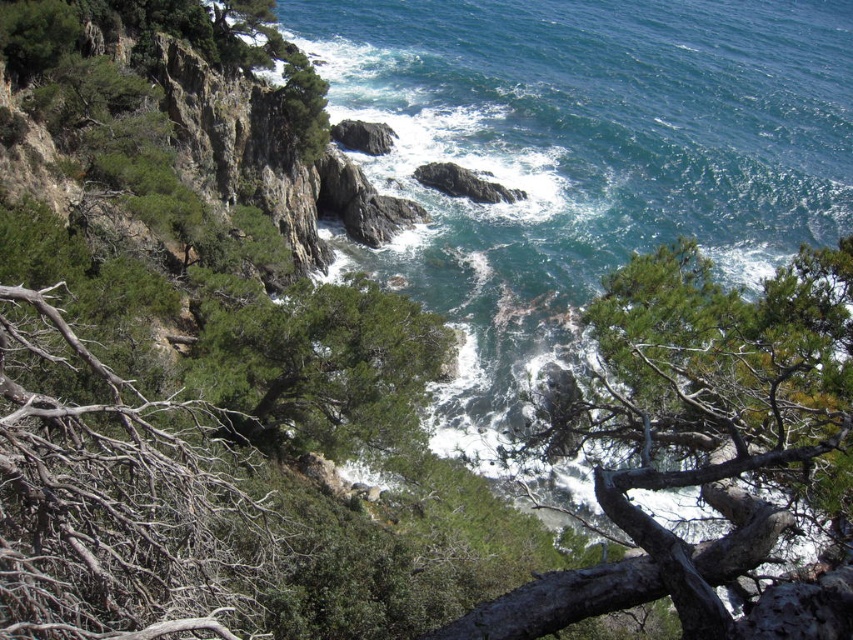
Question: Can you confirm if green leafy tree at center is positioned below rough rock at center-left?

Choices:
 (A) no
 (B) yes

Answer: (B)

Question: Which point is closer to the camera?

Choices:
 (A) rough rock at center-left
 (B) green leafy tree at center
 (C) brown dry branches at left
 (D) green rough tree at center

Answer: (C)

Question: In this image, where is green rough tree at center located relative to rough rock at center?

Choices:
 (A) right
 (B) left

Answer: (A)

Question: Among these objects, which one is nearest to the camera?

Choices:
 (A) green rough tree at center
 (B) green leafy tree at center

Answer: (A)

Question: Is green rough tree at center to the right of green leafy tree at center from the viewer's perspective?

Choices:
 (A) yes
 (B) no

Answer: (A)

Question: Among these objects, which one is farthest from the camera?

Choices:
 (A) rough rock at center
 (B) brown dry branches at left
 (C) rough rock at center-left

Answer: (C)